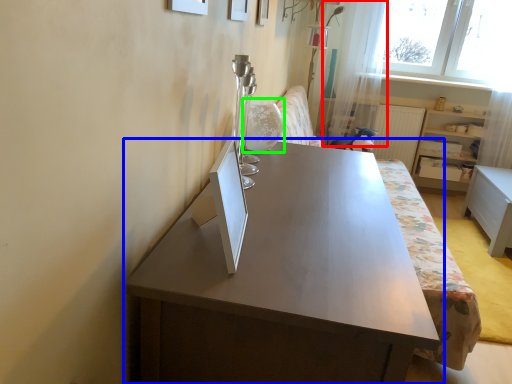
Question: Which object is positioned closest to curtain (highlighted by a red box)? Select from table (highlighted by a blue box) and swivel chair (highlighted by a green box).

Choices:
 (A) table
 (B) swivel chair

Answer: (B)